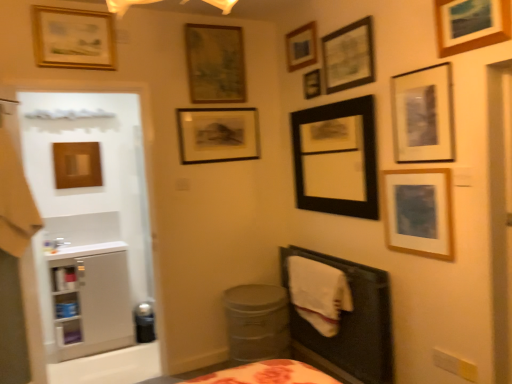
Identify the location of free location above black matte picture frame at upper center, which is the 5th picture frame from right to left (from a real-world perspective). The height and width of the screenshot is (384, 512). (328, 102).